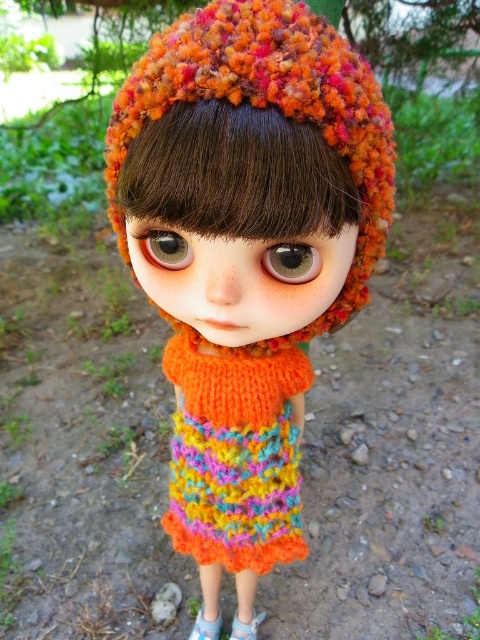
Does point (284, 406) lie behind point (241, 483)?

No, it is in front of (241, 483).

Is knitted orange hat at center above multicolored knitted dress at center?

Yes.

Who is more distant from viewer, (282, 397) or (214, 428)?

The point (282, 397) is more distant.

At what (x,y) coordinates should I click in order to perform the action: click on knitted orange hat at center. Please return your answer as a coordinate pair (x, y). The image size is (480, 640). Looking at the image, I should click on pyautogui.click(x=247, y=253).